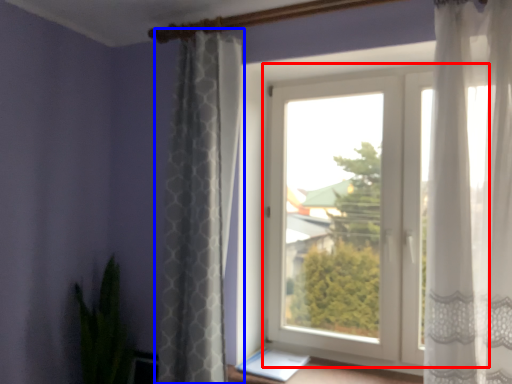
Question: Which point is further to the camera, window (highlighted by a red box) or curtain (highlighted by a blue box)?

Choices:
 (A) window
 (B) curtain

Answer: (A)